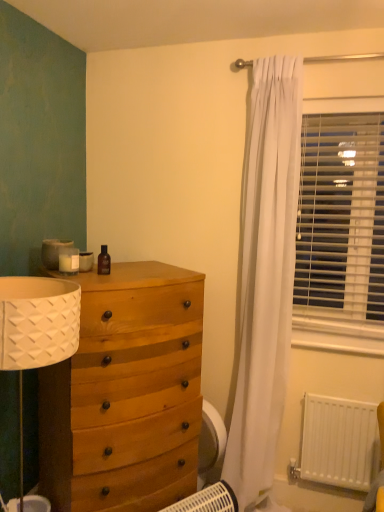
Question: Is white plastic heater at lower center shorter than white plastic blinds at right?

Choices:
 (A) yes
 (B) no

Answer: (A)

Question: Does white plastic heater at lower center appear on the left side of white plastic blinds at right?

Choices:
 (A) yes
 (B) no

Answer: (A)

Question: Does white plastic heater at lower center lie in front of white plastic blinds at right?

Choices:
 (A) no
 (B) yes

Answer: (B)

Question: Does white plastic heater at lower center lie behind white plastic blinds at right?

Choices:
 (A) yes
 (B) no

Answer: (B)

Question: From a real-world perspective, is white plastic heater at lower center on white plastic blinds at right?

Choices:
 (A) yes
 (B) no

Answer: (B)

Question: From a real-world perspective, is white plastic heater at lower center positioned under white plastic blinds at right based on gravity?

Choices:
 (A) yes
 (B) no

Answer: (A)

Question: From a real-world perspective, is white plastic blinds at right on top of white plastic heater at lower center?

Choices:
 (A) no
 (B) yes

Answer: (B)

Question: Is white plastic blinds at right further to the viewer compared to white plastic heater at lower center?

Choices:
 (A) yes
 (B) no

Answer: (A)

Question: Is white plastic blinds at right shorter than white plastic heater at lower center?

Choices:
 (A) yes
 (B) no

Answer: (B)

Question: From the image's perspective, is white plastic blinds at right over white plastic heater at lower center?

Choices:
 (A) no
 (B) yes

Answer: (B)

Question: Does white plastic blinds at right have a smaller size compared to white plastic heater at lower center?

Choices:
 (A) yes
 (B) no

Answer: (B)

Question: From a real-world perspective, does white plastic blinds at right sit lower than white plastic heater at lower center?

Choices:
 (A) no
 (B) yes

Answer: (A)

Question: From a real-world perspective, is white matte radiator at lower right located beneath white plastic heater at lower center?

Choices:
 (A) no
 (B) yes

Answer: (A)